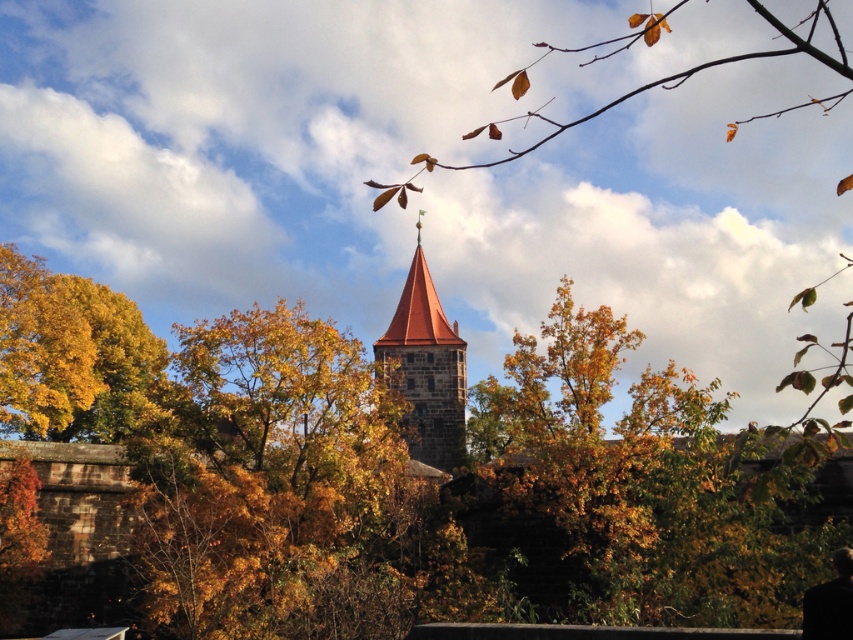
You are an artist planning to sketch the historic stone tower with its autumn surroundings. You notice the golden foliage at center and the black matte jacket at lower right in your viewfinder. Which object should you focus on first if you want to emphasize the most prominent feature in your sketch?

The golden foliage at center should be focused on first because it has a larger size compared to the black matte jacket at lower right, making it the most prominent feature in the scene.

You are an artist planning to paint the scene. You want to ensure the golden foliage at center and smooth stone tower at center are correctly placed according to their positions. Which object should you paint first if you follow the standard painting technique of starting with the background elements before moving to the foreground?

The smooth stone tower at center should be painted first because it is the background element, while the golden foliage at center is positioned on the right side of it, indicating it is in the foreground.